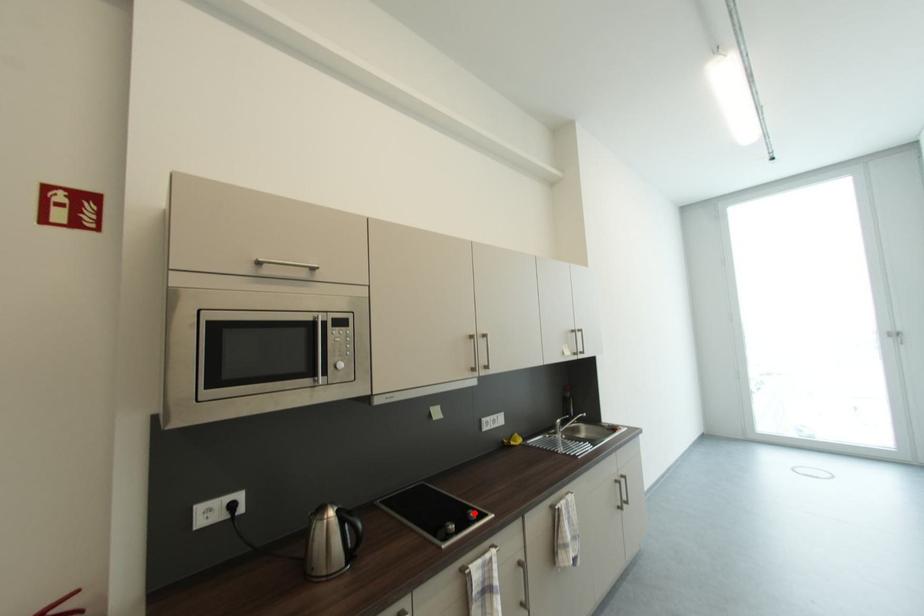
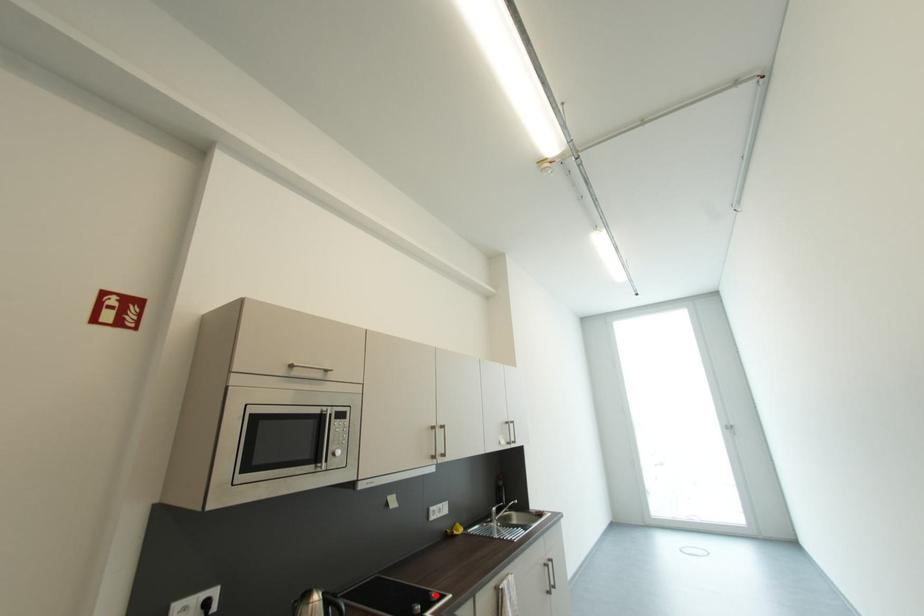
I am providing you with two images of the same scene from different viewpoints. A red point is marked on the first image and another point is marked on the second image. Do the highlighted points in image1 and image2 indicate the same real-world spot?

Yes